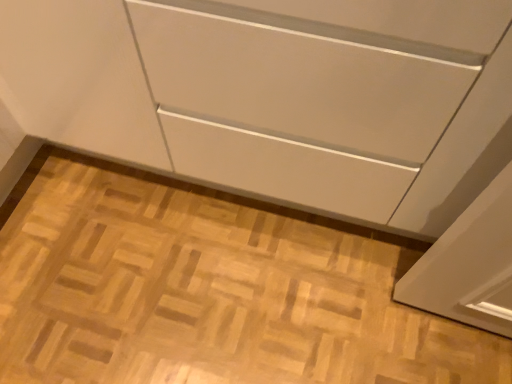
Question: From the image's perspective, is matte white cabinet at center located beneath white glossy cabinet at center?

Choices:
 (A) yes
 (B) no

Answer: (A)

Question: From a real-world perspective, is matte white cabinet at center positioned over white glossy cabinet at center based on gravity?

Choices:
 (A) yes
 (B) no

Answer: (B)

Question: Can you confirm if matte white cabinet at center is positioned to the left of white glossy cabinet at center?

Choices:
 (A) no
 (B) yes

Answer: (A)

Question: Is matte white cabinet at center next to white glossy cabinet at center and touching it?

Choices:
 (A) yes
 (B) no

Answer: (B)

Question: Is matte white cabinet at center located outside white glossy cabinet at center?

Choices:
 (A) yes
 (B) no

Answer: (A)

Question: Is matte white cabinet at center shorter than white glossy cabinet at center?

Choices:
 (A) yes
 (B) no

Answer: (A)

Question: From the image's perspective, is white glossy cabinet at center over matte white cabinet at center?

Choices:
 (A) no
 (B) yes

Answer: (B)

Question: Does white glossy cabinet at center turn towards matte white cabinet at center?

Choices:
 (A) no
 (B) yes

Answer: (B)

Question: Is white glossy cabinet at center positioned in front of matte white cabinet at center?

Choices:
 (A) no
 (B) yes

Answer: (B)

Question: From a real-world perspective, is white glossy cabinet at center on top of matte white cabinet at center?

Choices:
 (A) yes
 (B) no

Answer: (A)

Question: Is white glossy cabinet at center thinner than matte white cabinet at center?

Choices:
 (A) yes
 (B) no

Answer: (A)

Question: Can you confirm if white glossy cabinet at center is taller than matte white cabinet at center?

Choices:
 (A) no
 (B) yes

Answer: (B)

Question: Is matte white cabinet at center wider or thinner than white glossy cabinet at center?

Choices:
 (A) thin
 (B) wide

Answer: (B)